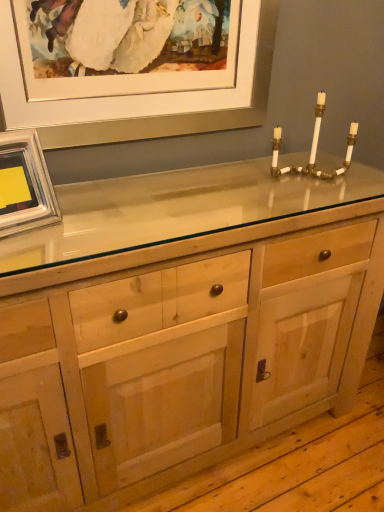
Question: From a real-world perspective, relative to natural wood cabinet at center, is matte white picture frame at upper center, arranged as the second picture frame when ordered from the bottom, vertically above or below?

Choices:
 (A) above
 (B) below

Answer: (A)

Question: From the image's perspective, relative to natural wood cabinet at center, is matte white picture frame at upper center, arranged as the second picture frame when ordered from the bottom, above or below?

Choices:
 (A) above
 (B) below

Answer: (A)

Question: Considering the real-world distances, which object is farthest from the natural wood cabinet at center?

Choices:
 (A) silver metallic picture frame at upper left, arranged as the 2th picture frame when viewed from the top
 (B) white ceramic candle holder at upper right
 (C) matte white picture frame at upper center, the 1th picture frame positioned from the top

Answer: (C)

Question: Which of these objects is positioned farthest from the matte white picture frame at upper center, the 1th picture frame positioned from the top?

Choices:
 (A) natural wood cabinet at center
 (B) silver metallic picture frame at upper left, arranged as the first picture frame when ordered from the bottom
 (C) white ceramic candle holder at upper right

Answer: (A)